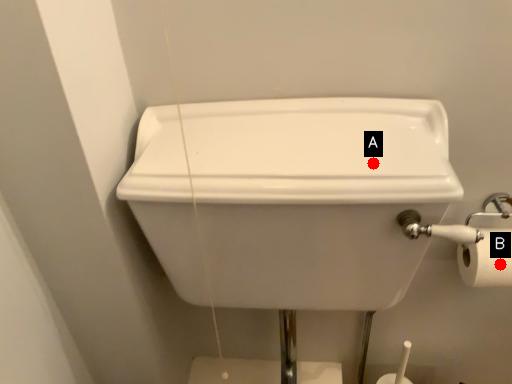
Question: Two points are circled on the image, labeled by A and B beside each circle. Which point is closer to the camera?

Choices:
 (A) A is closer
 (B) B is closer

Answer: (A)